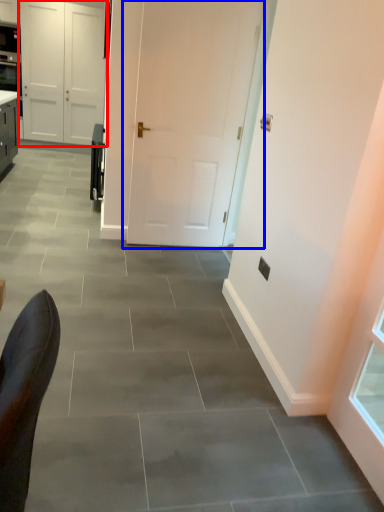
Question: Which point is closer to the camera, door (highlighted by a red box) or door (highlighted by a blue box)?

Choices:
 (A) door
 (B) door

Answer: (B)